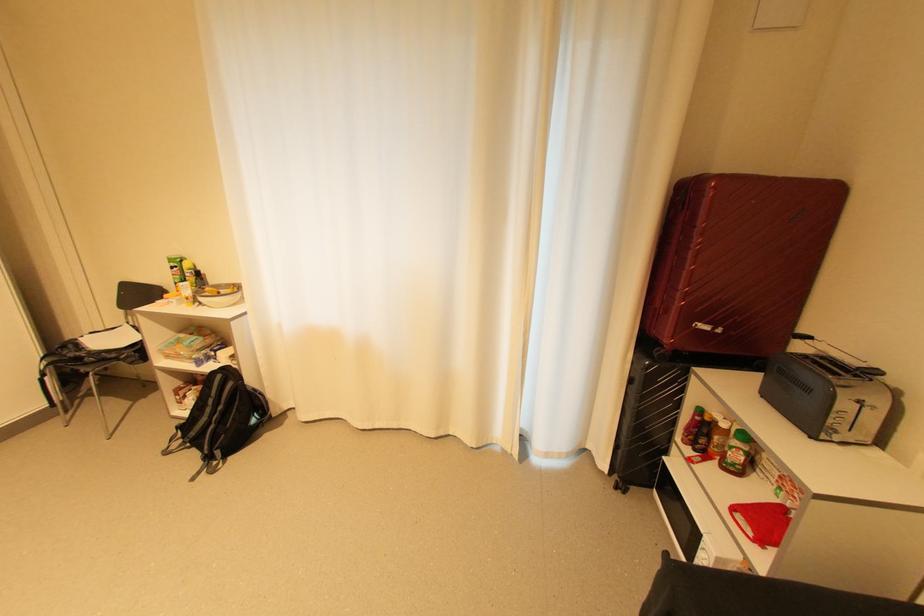
Where would you pull the black suitcase? Please return your answer as a coordinate pair (x, y).

(647, 416)